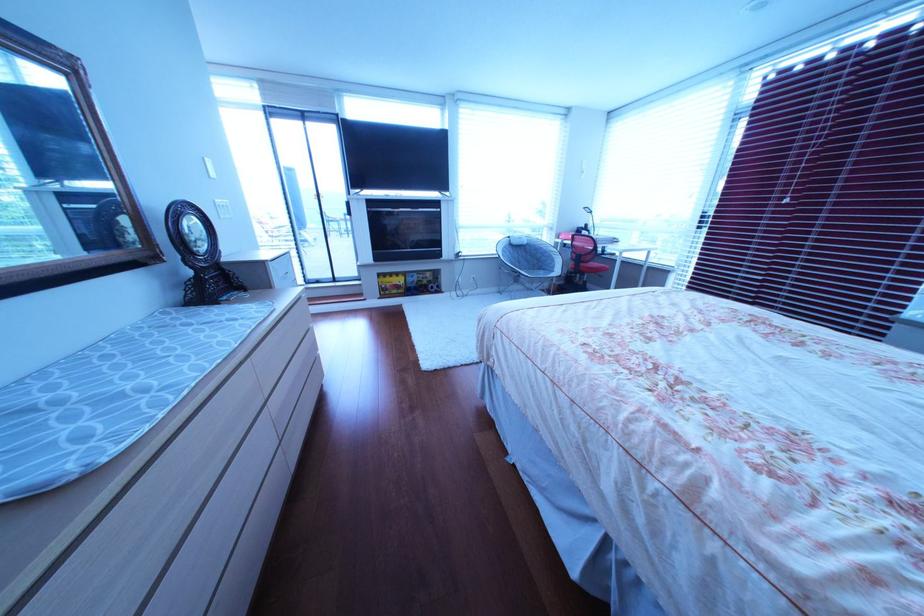
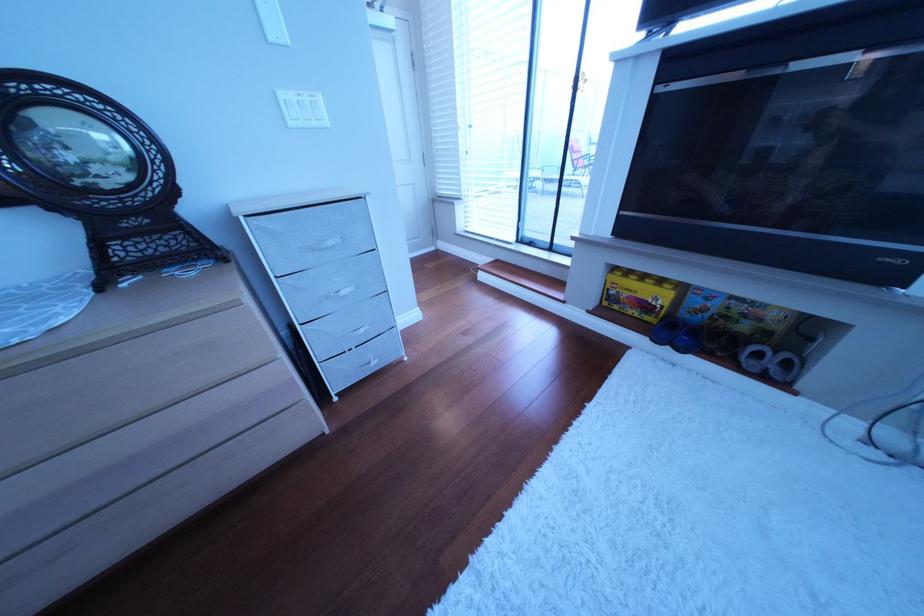
Find the pixel in the second image that matches (x=405, y=286) in the first image.

(640, 296)